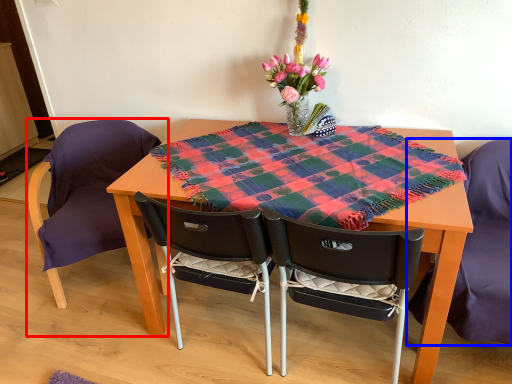
Question: Among these objects, which one is farthest to the camera, chair (highlighted by a red box) or chair (highlighted by a blue box)?

Choices:
 (A) chair
 (B) chair

Answer: (A)